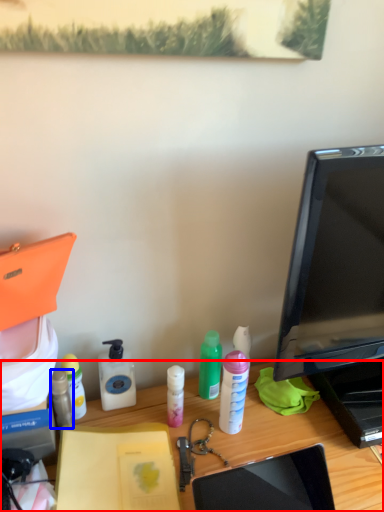
Question: Which of the following is the closest to the observer, desk (highlighted by a red box) or bottle (highlighted by a blue box)?

Choices:
 (A) desk
 (B) bottle

Answer: (A)